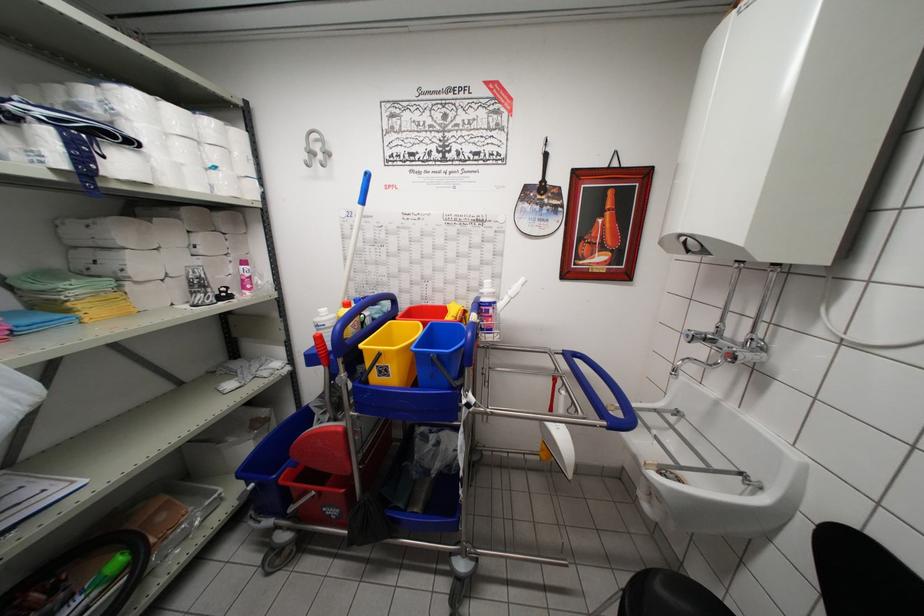
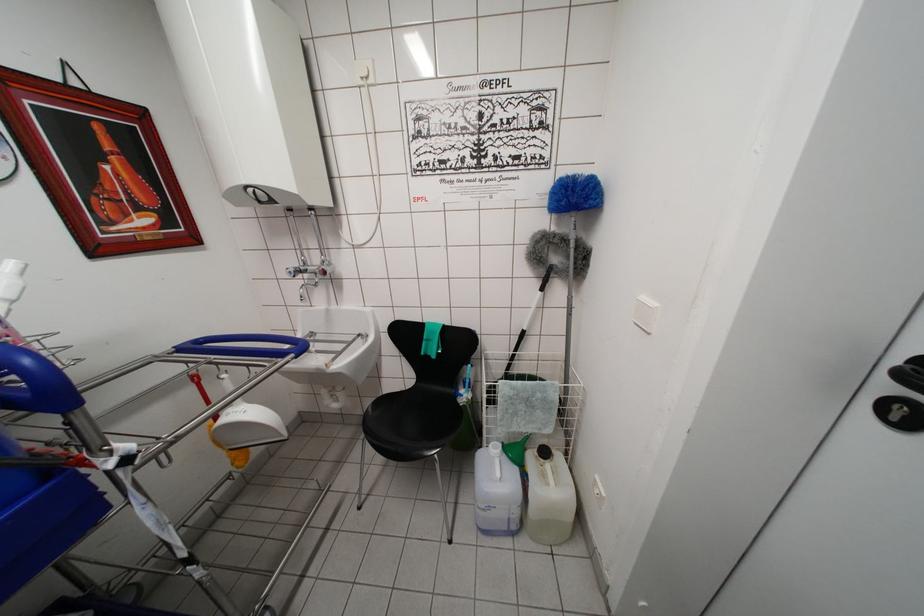
Locate, in the second image, the point that corresponds to point (690, 339) in the first image.

(293, 277)